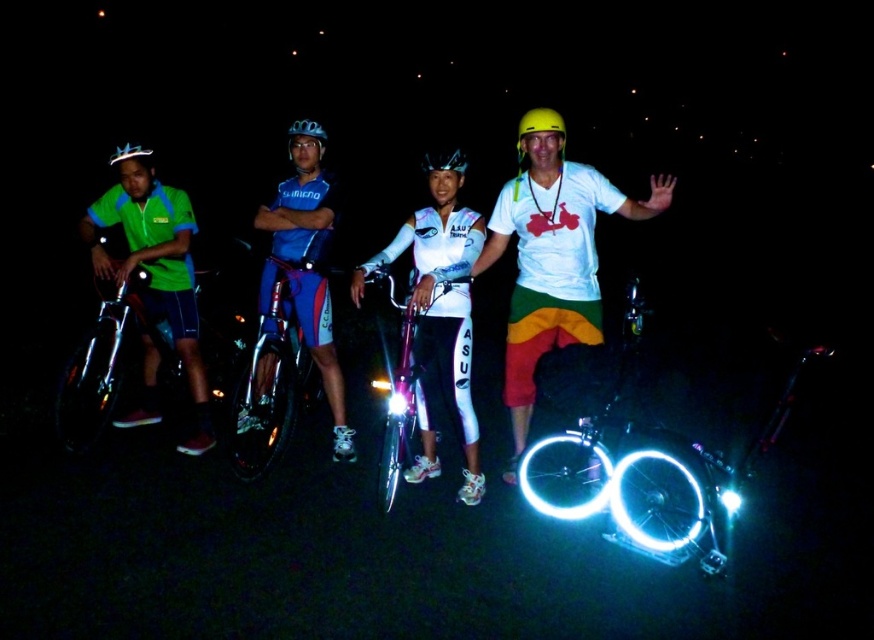
You are standing at the point with coordinates point (288, 132) and want to move towards the point with coordinates point (290, 365). According to the scene, which direction should you move to reach your destination?

You should move forward because point (290, 365) is in front of point (288, 132).